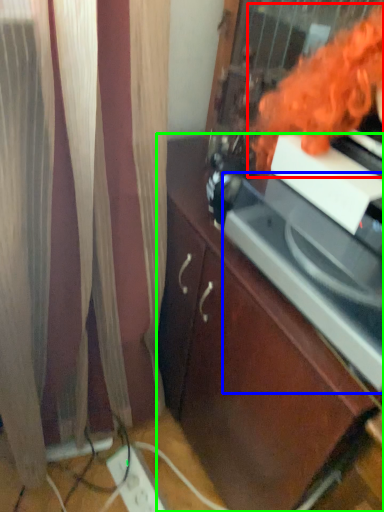
Question: Which object is positioned closest to woman (highlighted by a red box)? Select from appliance (highlighted by a blue box) and cabinetry (highlighted by a green box).

Choices:
 (A) appliance
 (B) cabinetry

Answer: (A)